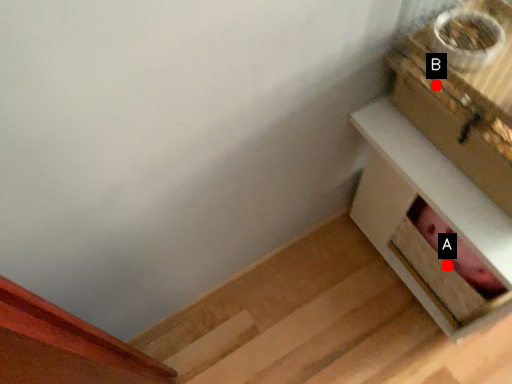
Question: Two points are circled on the image, labeled by A and B beside each circle. Which point is closer to the camera taking this photo?

Choices:
 (A) A is closer
 (B) B is closer

Answer: (B)